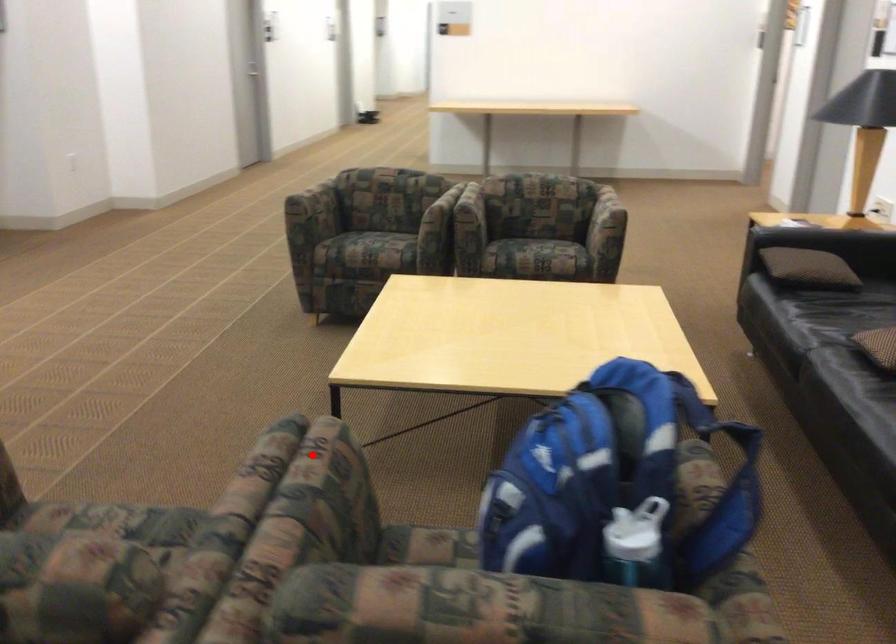
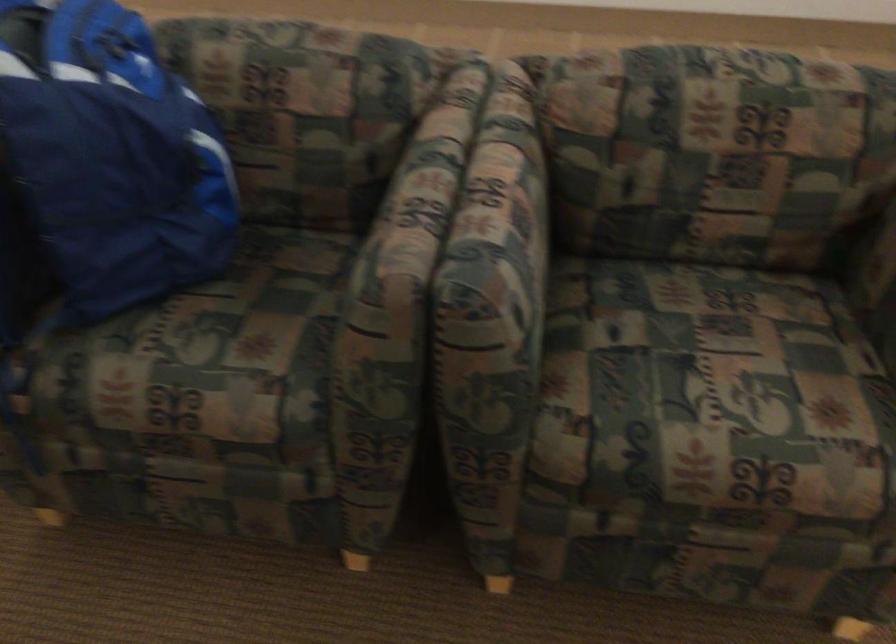
The point at the highlighted location is marked in the first image. Where is the corresponding point in the second image?

(412, 207)